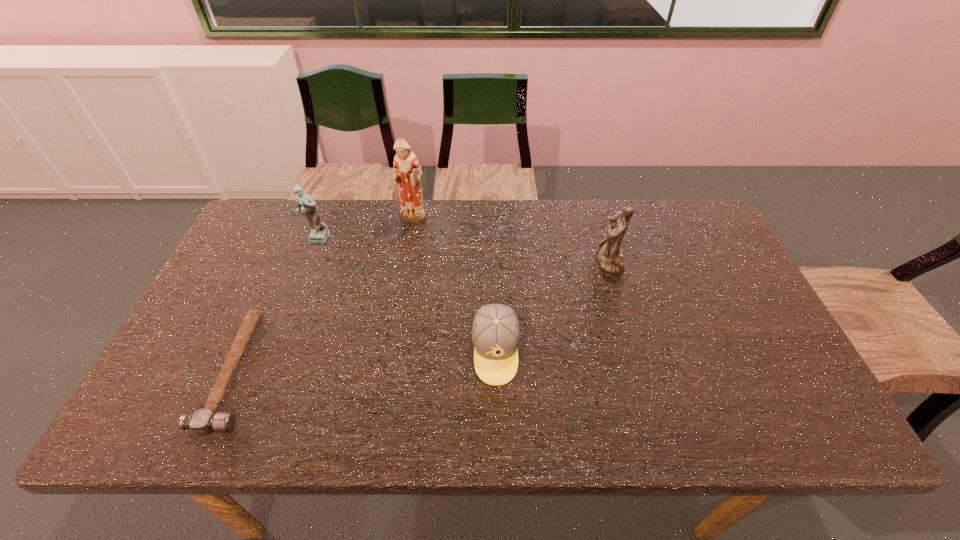
The height and width of the screenshot is (540, 960). I want to click on vacant space that satisfies the following two spatial constraints: 1. on the front-facing side of the fourth object from left to right; 2. on the striking face of the hammer, so click(496, 370).

Where is `vacant region that satisfies the following two spatial constraints: 1. on the front-facing side of the baseball cap; 2. on the striking face of the hammer`? Image resolution: width=960 pixels, height=540 pixels. vacant region that satisfies the following two spatial constraints: 1. on the front-facing side of the baseball cap; 2. on the striking face of the hammer is located at coordinates (496, 370).

Where is `vacant area that satisfies the following two spatial constraints: 1. on the front-facing side of the leftmost figurine; 2. on the striking face of the shortest object`? This screenshot has height=540, width=960. vacant area that satisfies the following two spatial constraints: 1. on the front-facing side of the leftmost figurine; 2. on the striking face of the shortest object is located at coordinates (267, 370).